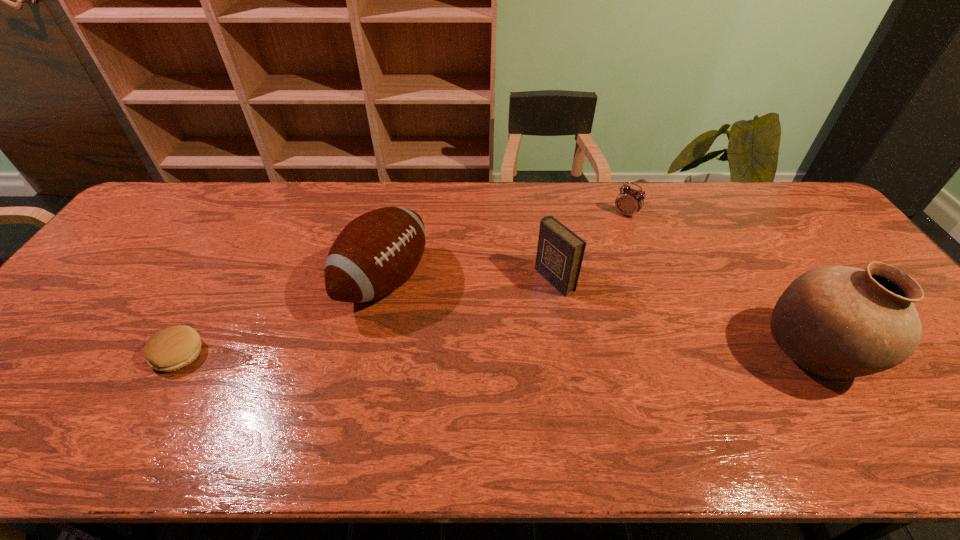
In order to click on vacant space located on the face of the second shortest object in this screenshot , I will do `click(586, 264)`.

Find the location of a particular element. This screenshot has width=960, height=540. object present at the far edge is located at coordinates [629, 201].

Where is `patty that is at the near edge`? The height and width of the screenshot is (540, 960). patty that is at the near edge is located at coordinates (171, 348).

I want to click on pottery that is at the near edge, so click(x=838, y=322).

Identify the location of vacant area at the far edge of the desktop. (388, 197).

In the image, there is a desktop. Where is `free space at the near edge`? The image size is (960, 540). free space at the near edge is located at coordinates (858, 399).

At what (x,y) coordinates should I click in order to perform the action: click on free space at the left edge. Please return your answer as a coordinate pair (x, y). The width and height of the screenshot is (960, 540). Looking at the image, I should click on (100, 294).

The width and height of the screenshot is (960, 540). What are the coordinates of `vacant area at the right edge` in the screenshot? It's located at (915, 355).

Locate an element on the screen. vacant space at the near left corner of the desktop is located at coordinates (28, 403).

The height and width of the screenshot is (540, 960). What are the coordinates of `free region at the far right corner` in the screenshot? It's located at (778, 207).